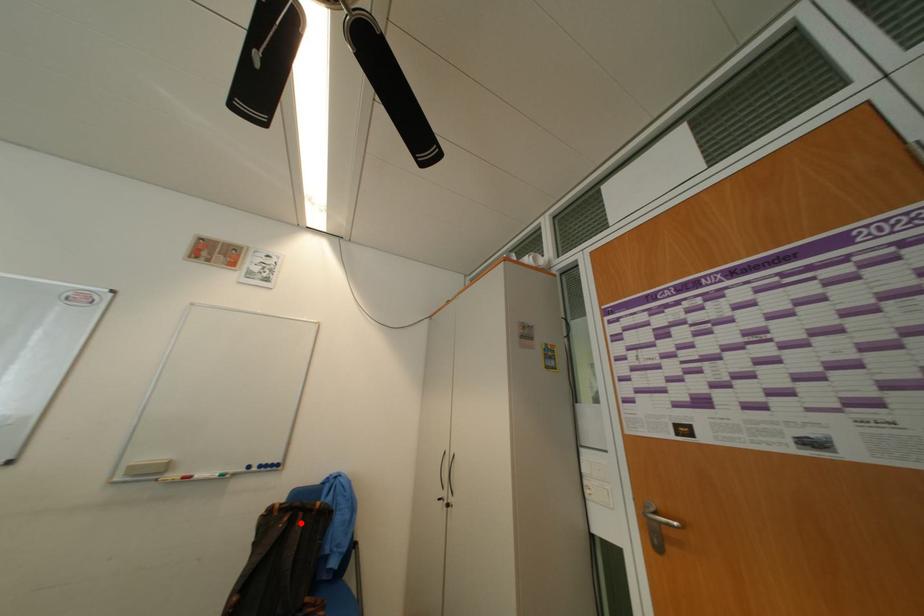
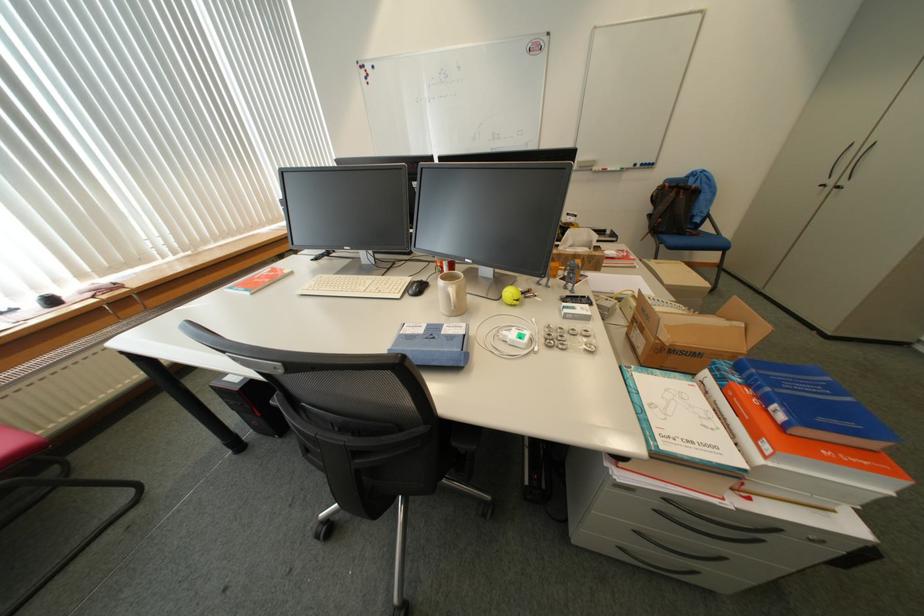
Question: I am providing you with two images of the same scene from different viewpoints. Given a red point in image1, look at the same physical point in image2. Is it:

Choices:
 (A) Closer to the viewpoint
 (B) Farther from the viewpoint

Answer: (A)